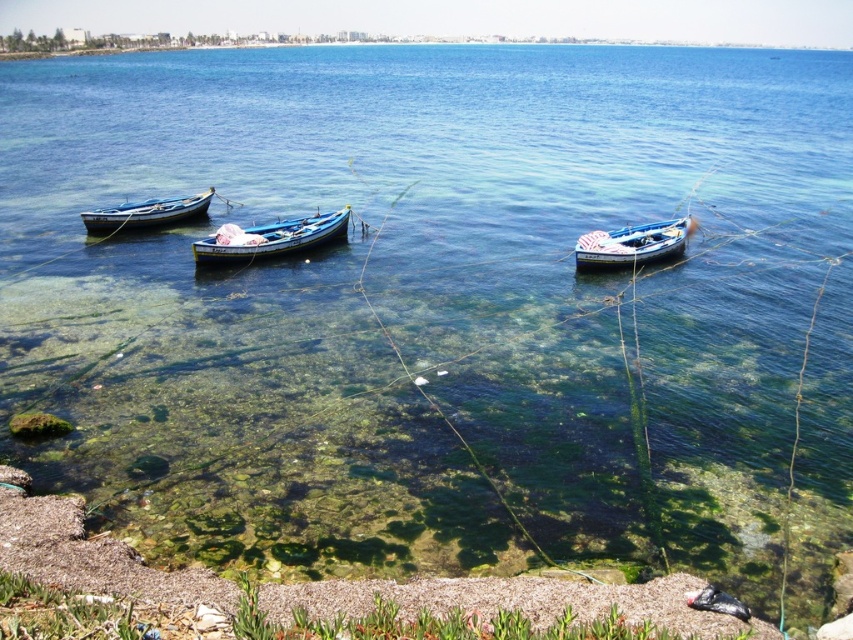
You are a marine biologist observing the boats in the coastal scene. You notice two boats labeled as wooden blue boat at center and blue wooden boat at center. Which boat is directly above the other?

The wooden blue boat at center is positioned over blue wooden boat at center, meaning it is directly above the other.

Consider the image. You are standing on the shore looking at the three small fishing boats. Which boat is positioned to the left between the wooden blue boat at center and the blue wooden boat at center?

The wooden blue boat at center is positioned to the left of the blue wooden boat at center.

You are a marine biologist studying the boats in this coastal scene. You need to determine which boat has a larger size between the blue wooden boat at center and the wooden boat at left. Which one is bigger?

The wooden boat at left is larger than the blue wooden boat at center.